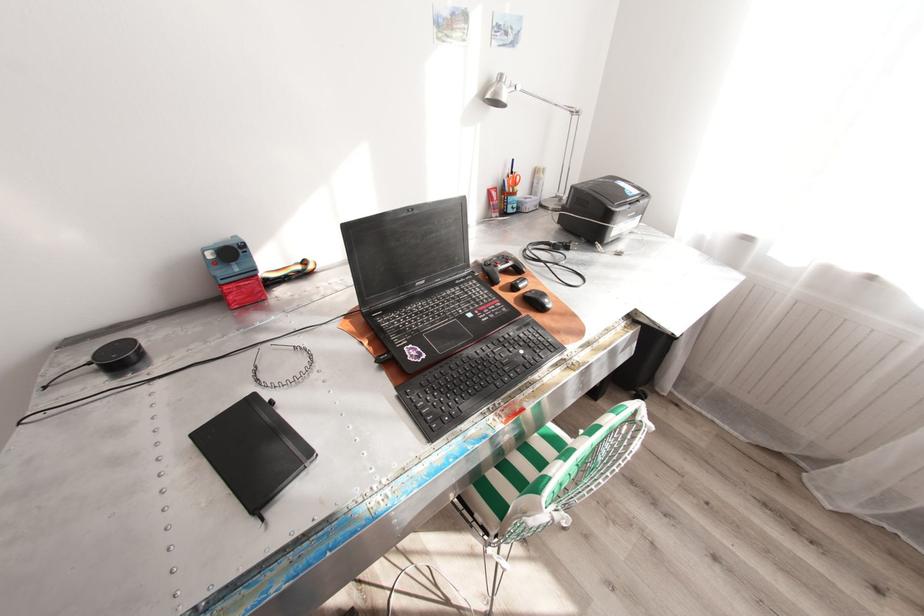
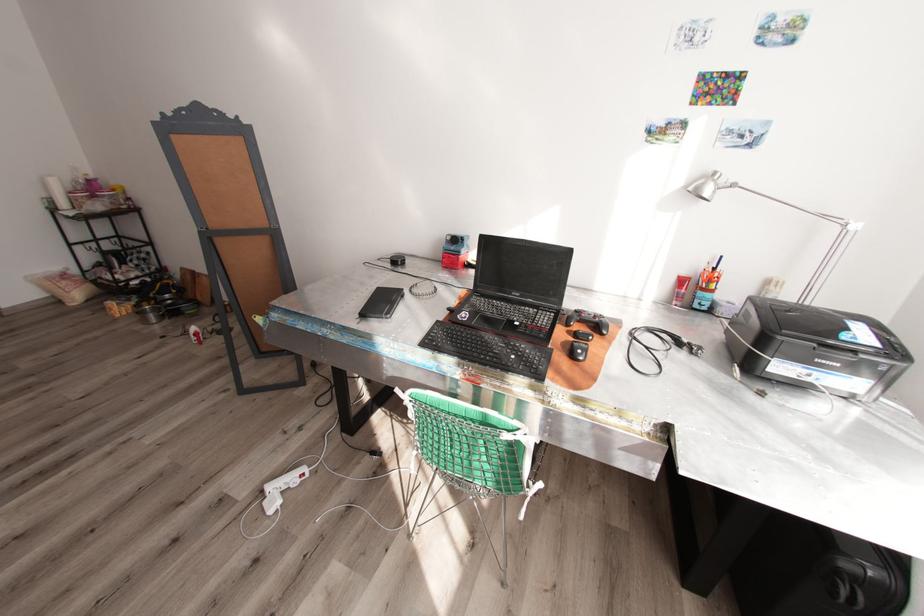
Find the pixel in the second image that matches pixel 427 282 in the first image.

(523, 294)